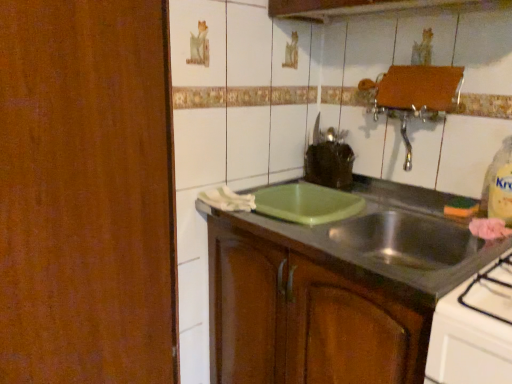
This screenshot has height=384, width=512. What do you see at coordinates (398, 236) in the screenshot?
I see `green plastic cutting board at center` at bounding box center [398, 236].

You are a GUI agent. You are given a task and a screenshot of the screen. Output one action in this format:
    pyautogui.click(x=<x>, y=<y>)
    Task: Click on the green plastic cutting board at center
    
    Given the screenshot: What is the action you would take?
    pyautogui.click(x=398, y=236)

What do you see at coordinates (307, 314) in the screenshot? This screenshot has height=384, width=512. I see `green matte cutting board at center` at bounding box center [307, 314].

Where is `green matte cutting board at center`? This screenshot has height=384, width=512. green matte cutting board at center is located at coordinates (307, 314).

The height and width of the screenshot is (384, 512). What are the coordinates of `green plastic cutting board at center` in the screenshot? It's located at (398, 236).

Considering the positions of objects green matte cutting board at center and green plastic cutting board at center in the image provided, who is more to the left, green matte cutting board at center or green plastic cutting board at center?

Positioned to the left is green matte cutting board at center.

Between green matte cutting board at center and green plastic cutting board at center, which one is positioned behind?

green matte cutting board at center.

Considering the points (268, 300) and (386, 219), which point is behind, point (268, 300) or point (386, 219)?

The point (386, 219) is farther from the camera.

From the image's perspective, relative to green plastic cutting board at center, is green matte cutting board at center above or below?

Based on their image positions, green matte cutting board at center is located beneath green plastic cutting board at center.

From a real-world perspective, between green matte cutting board at center and green plastic cutting board at center, who is vertically lower?

green matte cutting board at center, from a real-world perspective.

Between green matte cutting board at center and green plastic cutting board at center, which one has larger width?

green plastic cutting board at center is wider.

Which of these two, green matte cutting board at center or green plastic cutting board at center, stands taller?

With more height is green matte cutting board at center.

Who is smaller, green matte cutting board at center or green plastic cutting board at center?

With smaller size is green plastic cutting board at center.

Is green matte cutting board at center not inside green plastic cutting board at center?

Yes, green matte cutting board at center is outside of green plastic cutting board at center.

Is green matte cutting board at center beside green plastic cutting board at center?

They are not placed beside each other.

Is green matte cutting board at center aimed at green plastic cutting board at center?

No, green matte cutting board at center is not oriented towards green plastic cutting board at center.

You are a GUI agent. You are given a task and a screenshot of the screen. Output one action in this format:
    pyautogui.click(x=<x>, y=<y>)
    Task: Click on the countertop above the green matte cutting board at center (from the image's perspective)
    This screenshot has width=512, height=384.
    Given the screenshot: What is the action you would take?
    pyautogui.click(x=398, y=236)

Based on their positions, is green plastic cutting board at center located to the left or right of green matte cutting board at center?

From the image, it's evident that green plastic cutting board at center is to the right of green matte cutting board at center.

Is the depth of green plastic cutting board at center less than that of green matte cutting board at center?

Yes, it is in front of green matte cutting board at center.

Does point (489, 251) come in front of point (356, 328)?

No, (489, 251) is behind (356, 328).

From the image's perspective, does green plastic cutting board at center appear lower than green matte cutting board at center?

No, from the image's perspective, green plastic cutting board at center is not beneath green matte cutting board at center.

From a real-world perspective, which is physically below, green plastic cutting board at center or green matte cutting board at center?

green matte cutting board at center is physically lower.

Considering the relative sizes of green plastic cutting board at center and green matte cutting board at center in the image provided, is green plastic cutting board at center wider than green matte cutting board at center?

Yes, green plastic cutting board at center is wider than green matte cutting board at center.

Consider the image. From their relative heights in the image, would you say green plastic cutting board at center is taller or shorter than green matte cutting board at center?

Clearly, green plastic cutting board at center is shorter compared to green matte cutting board at center.

Consider the image. Considering the sizes of objects green plastic cutting board at center and green matte cutting board at center in the image provided, who is smaller, green plastic cutting board at center or green matte cutting board at center?

Smaller between the two is green plastic cutting board at center.

Could green matte cutting board at center be considered to be inside green plastic cutting board at center?

No, green matte cutting board at center is located outside of green plastic cutting board at center.

Is green plastic cutting board at center next to green matte cutting board at center and touching it?

There is a gap between green plastic cutting board at center and green matte cutting board at center.

Is green matte cutting board at center at the back of green plastic cutting board at center?

Yes, green plastic cutting board at center is positioned with its back facing green matte cutting board at center.

Where is `cabinetry behind the green plastic cutting board at center`? This screenshot has height=384, width=512. cabinetry behind the green plastic cutting board at center is located at coordinates (307, 314).

Image resolution: width=512 pixels, height=384 pixels. What are the coordinates of `countertop above the green matte cutting board at center (from the image's perspective)` in the screenshot? It's located at (398, 236).

Where is `countertop that appears above the green matte cutting board at center (from a real-world perspective)`? countertop that appears above the green matte cutting board at center (from a real-world perspective) is located at coordinates point(398,236).